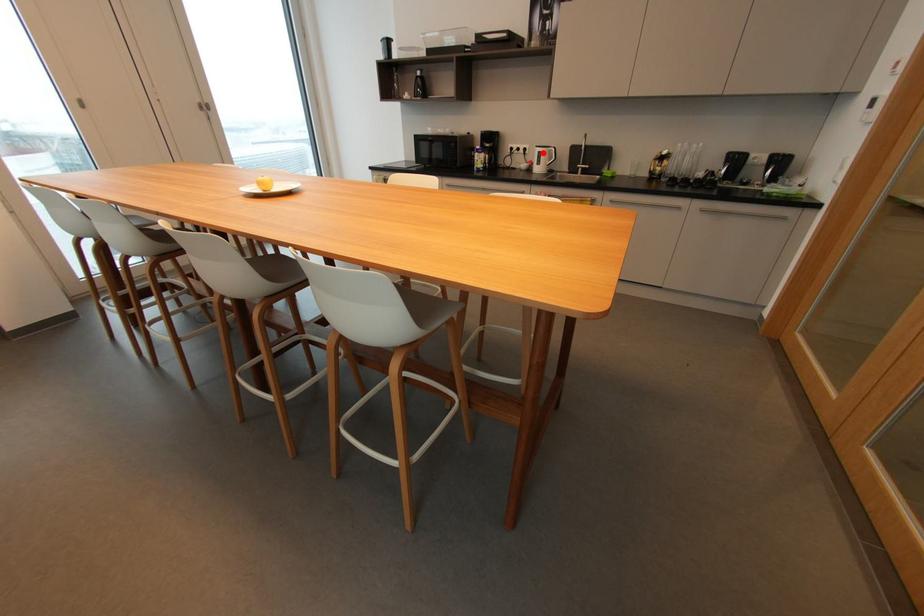
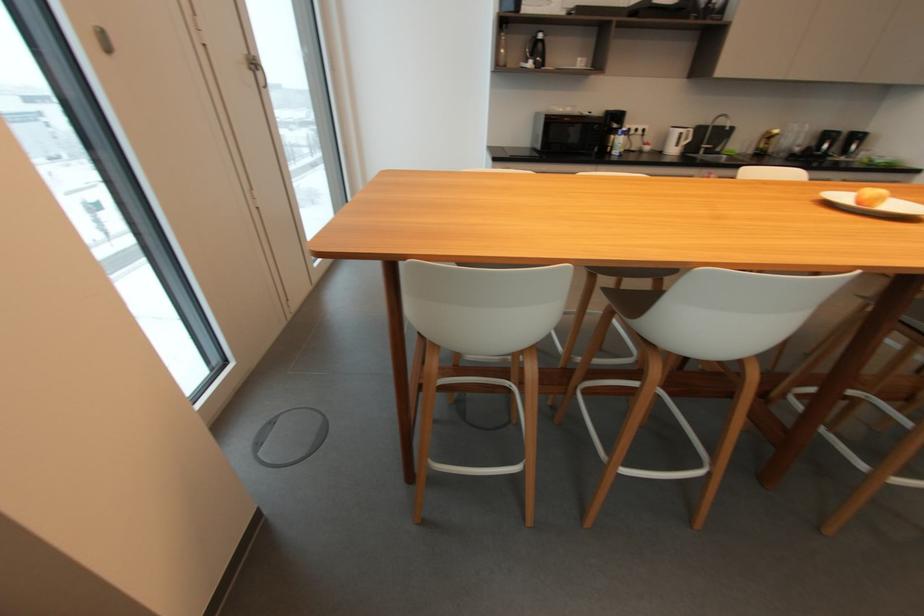
Question: I am providing you with two images of the same scene from different viewpoints. Image1 has a red point marked. In image2, the corresponding 3D location appears at what relative position? Reply with the corresponding letter.

Choices:
 (A) Closer
 (B) Farther

Answer: (B)